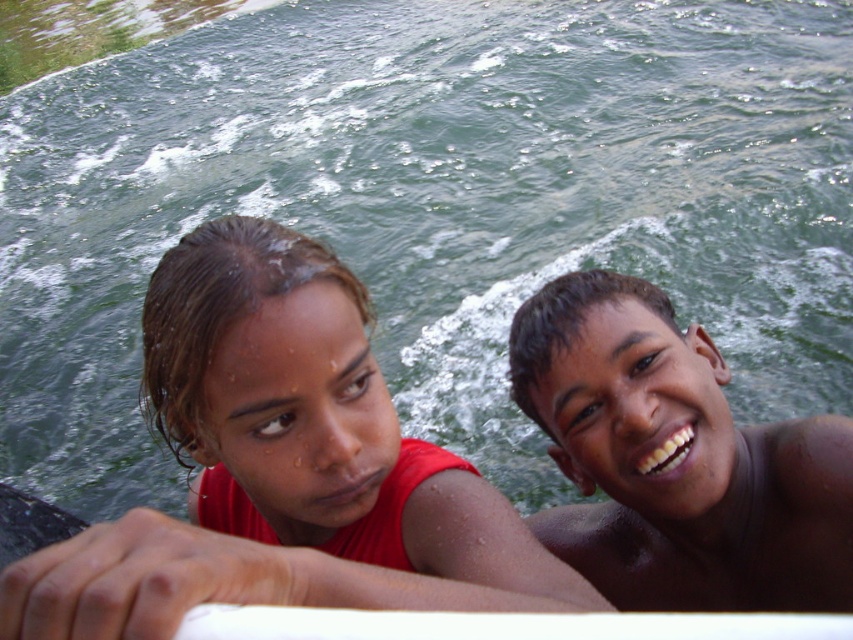
Question: Which point is closer to the camera?

Choices:
 (A) (585, 433)
 (B) (299, 385)

Answer: (B)

Question: Can you confirm if matte red shirt at center is positioned to the right of brown shiny skin at upper right?

Choices:
 (A) yes
 (B) no

Answer: (B)

Question: Does matte red shirt at center appear on the left side of brown shiny skin at upper right?

Choices:
 (A) no
 (B) yes

Answer: (B)

Question: Can you confirm if matte red shirt at center is bigger than brown shiny skin at upper right?

Choices:
 (A) no
 (B) yes

Answer: (B)

Question: Which point is farther to the camera?

Choices:
 (A) (224, 310)
 (B) (610, 349)

Answer: (B)